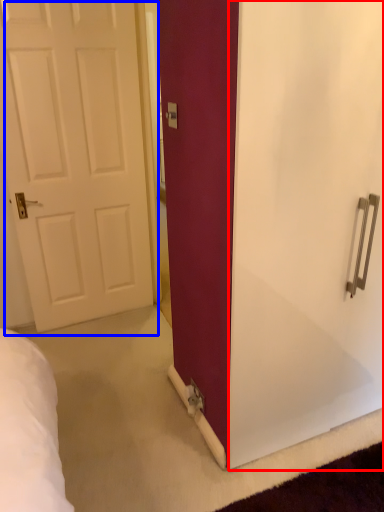
Question: Which object appears farthest to the camera in this image, screen door (highlighted by a red box) or door (highlighted by a blue box)?

Choices:
 (A) screen door
 (B) door

Answer: (B)